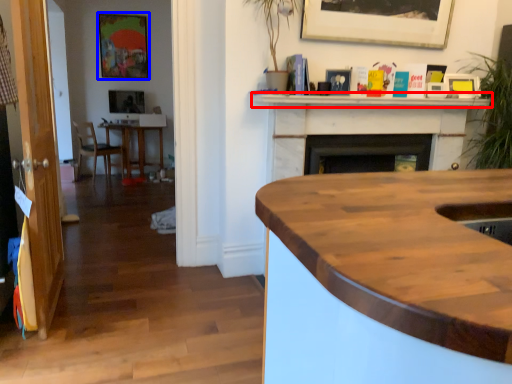
Question: Among these objects, which one is nearest to the camera, mantle (highlighted by a red box) or picture frame (highlighted by a blue box)?

Choices:
 (A) mantle
 (B) picture frame

Answer: (A)